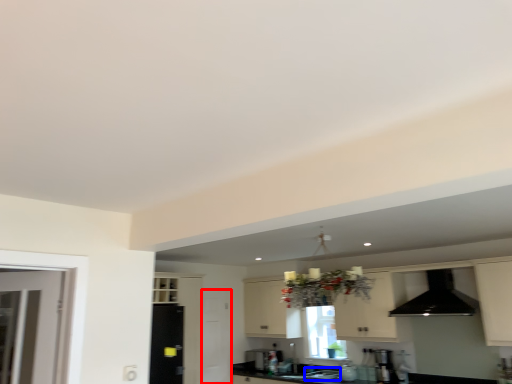
Question: Which point is closer to the camera, screen door (highlighted by a red box) or sink (highlighted by a blue box)?

Choices:
 (A) screen door
 (B) sink

Answer: (B)